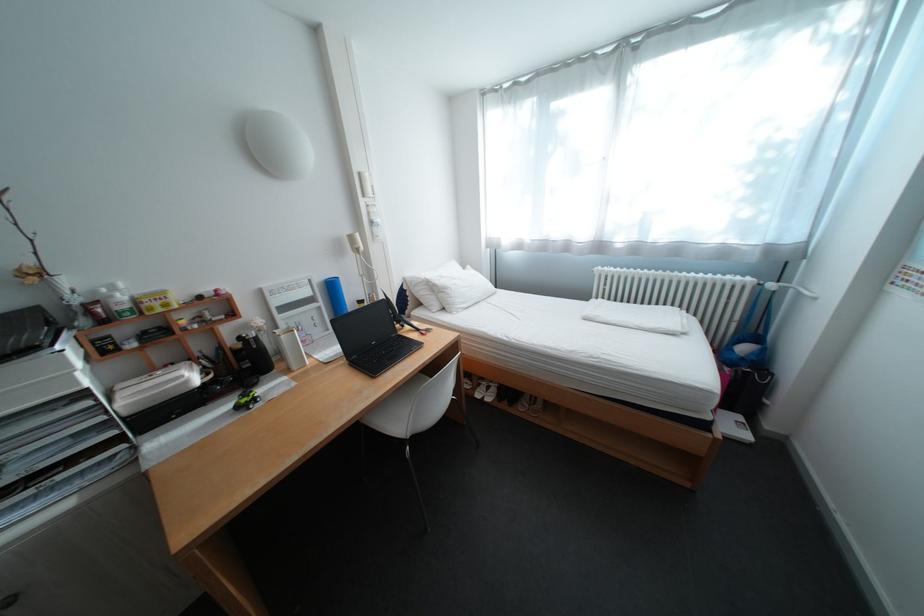
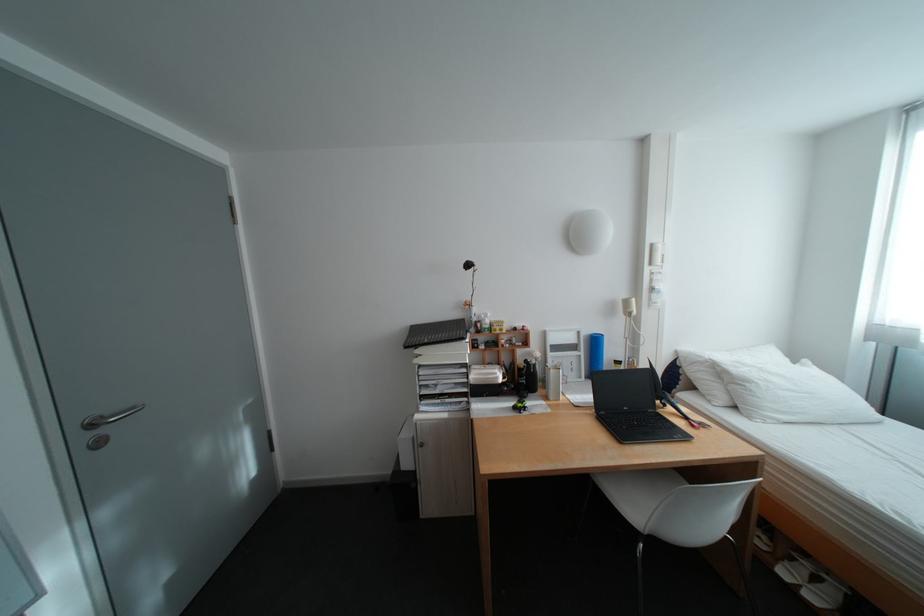
The point at (238, 407) is marked in the first image. Where is the corresponding point in the second image?

(523, 403)